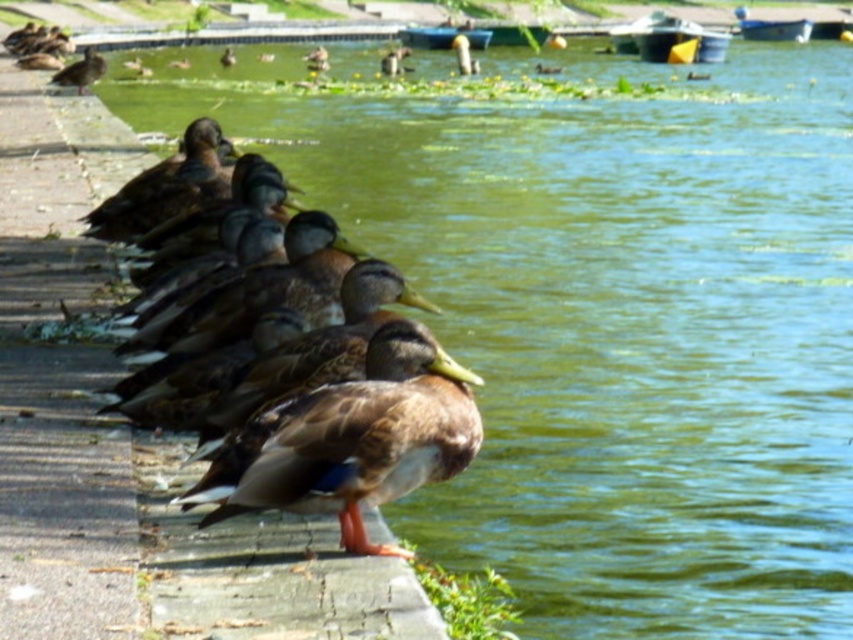
Which is below, brown feathered mallard duck at left or brown matte duck at upper left?

brown feathered mallard duck at left is below.

Between point (280, 406) and point (80, 77), which one is positioned in front?

Point (280, 406)

At what (x,y) coordinates should I click in order to perform the action: click on brown feathered mallard duck at left. Please return your answer as a coordinate pair (x, y). Looking at the image, I should click on (352, 440).

Where is `brown feathered mallard duck at left`? brown feathered mallard duck at left is located at coordinates (352, 440).

Between point (347, 368) and point (91, 67), which one is positioned in front?

Positioned in front is point (347, 368).

Looking at this image, does brown matte duck at left appear on the right side of brown matte duck at upper left?

Yes, brown matte duck at left is to the right of brown matte duck at upper left.

Is point (454, 381) closer to viewer compared to point (90, 83)?

Yes, point (454, 381) is in front of point (90, 83).

Where is `brown matte duck at left`? brown matte duck at left is located at coordinates [x=318, y=413].

Is brown matte duck at left to the right of brown feathered mallard duck at left from the viewer's perspective?

Yes, brown matte duck at left is to the right of brown feathered mallard duck at left.

Between brown matte duck at left and brown feathered mallard duck at left, which one is positioned higher?

Positioned higher is brown matte duck at left.

Where is `brown matte duck at left`? The height and width of the screenshot is (640, 853). brown matte duck at left is located at coordinates (318, 413).